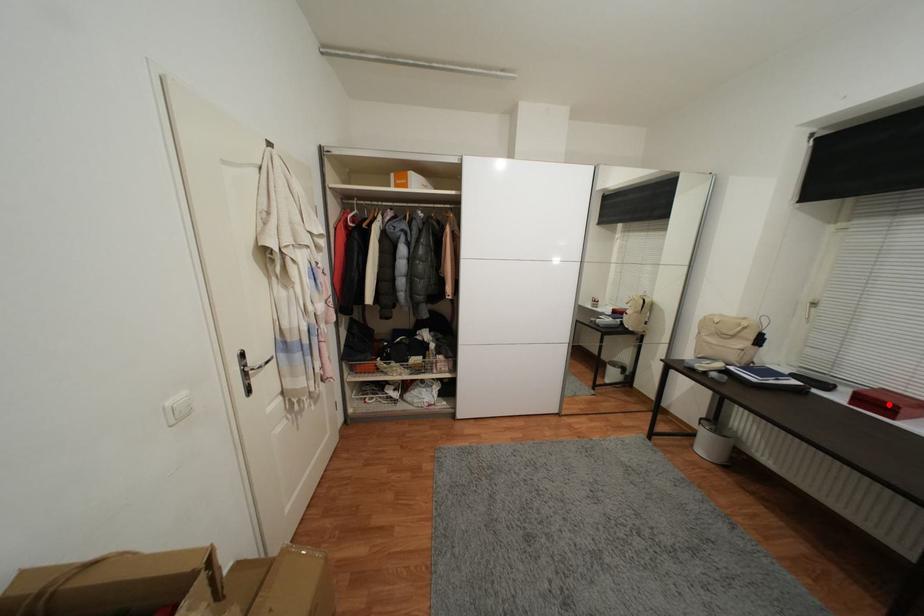
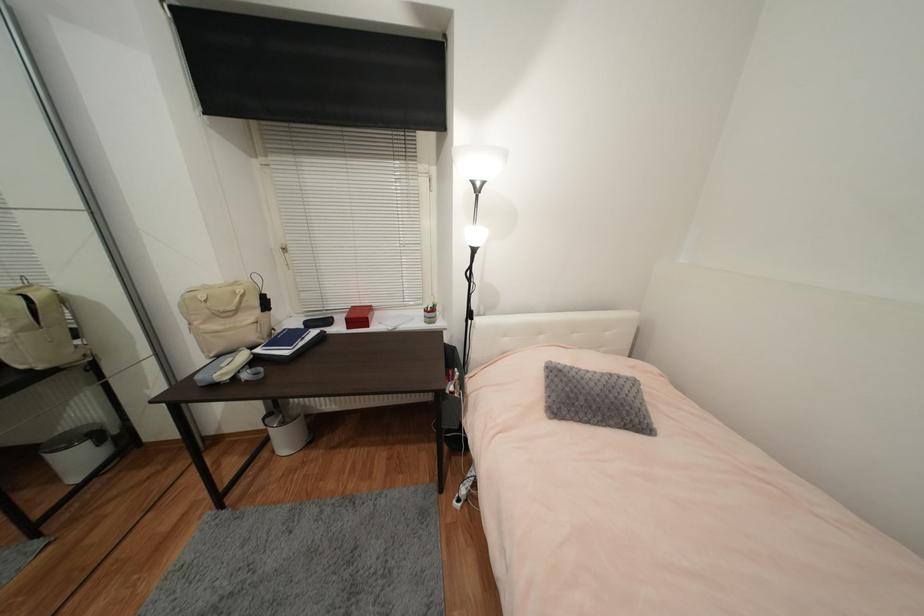
Question: I am providing you with two images of the same scene from different viewpoints. A red point is shown in image1. For the corresponding object point in image2, is it positioned nearer or farther from the camera?

Choices:
 (A) Nearer
 (B) Farther

Answer: (A)